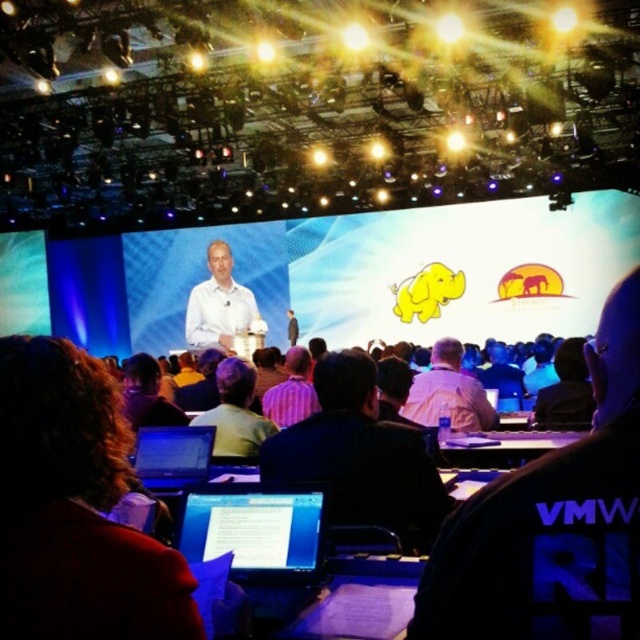
Between white matte shirt at center and white shirt at center, which one is positioned lower?

Positioned lower is white shirt at center.

Is point (228, 323) behind point (436, 344)?

That is True.

At what (x,y) coordinates should I click in order to perform the action: click on white matte shirt at center. Please return your answer as a coordinate pair (x, y). Image resolution: width=640 pixels, height=640 pixels. Looking at the image, I should click on (220, 305).

Between brown hair at center and white matte shirt at center, which one is positioned lower?

brown hair at center is below.

Can you confirm if brown hair at center is positioned above white matte shirt at center?

No.

What do you see at coordinates (76, 508) in the screenshot?
I see `brown hair at center` at bounding box center [76, 508].

Locate an element on the screen. brown hair at center is located at coordinates (76, 508).

Can you confirm if light blue shirt at center is taller than brown hair at center?

Yes, light blue shirt at center is taller than brown hair at center.

Is light blue shirt at center closer to camera compared to brown hair at center?

Yes, it is in front of brown hair at center.

This screenshot has height=640, width=640. What do you see at coordinates (552, 522) in the screenshot? I see `light blue shirt at center` at bounding box center [552, 522].

You are a GUI agent. You are given a task and a screenshot of the screen. Output one action in this format:
    pyautogui.click(x=<x>, y=<y>)
    Task: Click on the light blue shirt at center
    
    Given the screenshot: What is the action you would take?
    pyautogui.click(x=552, y=522)